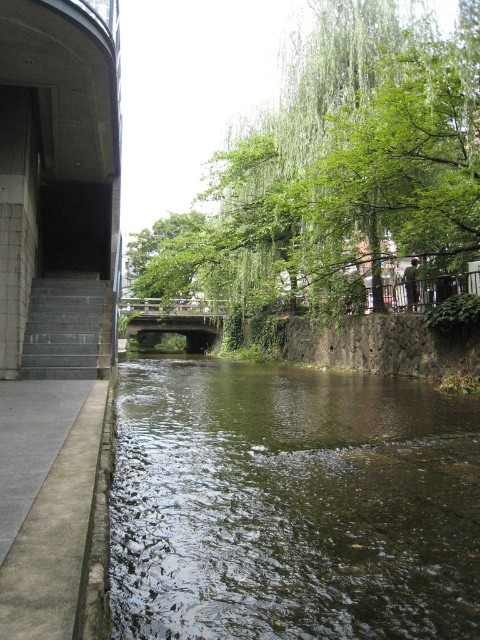
Question: Which point is closer to the camera taking this photo?

Choices:
 (A) (40, 628)
 (B) (231, 232)

Answer: (A)

Question: Which point is closer to the camera?

Choices:
 (A) green leafy tree at center
 (B) dark green water at center

Answer: (B)

Question: Is gray concrete stairs at left positioned behind wooden bridge at center?

Choices:
 (A) no
 (B) yes

Answer: (A)

Question: Observing the image, what is the correct spatial positioning of gray concrete pavement at lower left in reference to wooden bridge at center?

Choices:
 (A) above
 (B) below

Answer: (B)

Question: Which of the following is the farthest from the observer?

Choices:
 (A) (86, 304)
 (B) (130, 312)
 (C) (312, 97)
 (D) (84, 426)

Answer: (B)

Question: Can you confirm if gray concrete pavement at lower left is positioned to the left of gray concrete stairs at left?

Choices:
 (A) yes
 (B) no

Answer: (B)